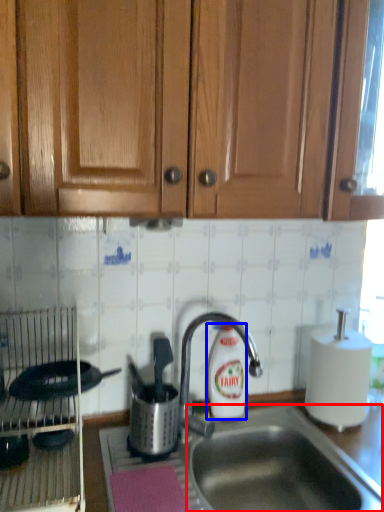
Question: Which object appears closest to the camera in this image, sink (highlighted by a red box) or cleaning product (highlighted by a blue box)?

Choices:
 (A) sink
 (B) cleaning product

Answer: (A)